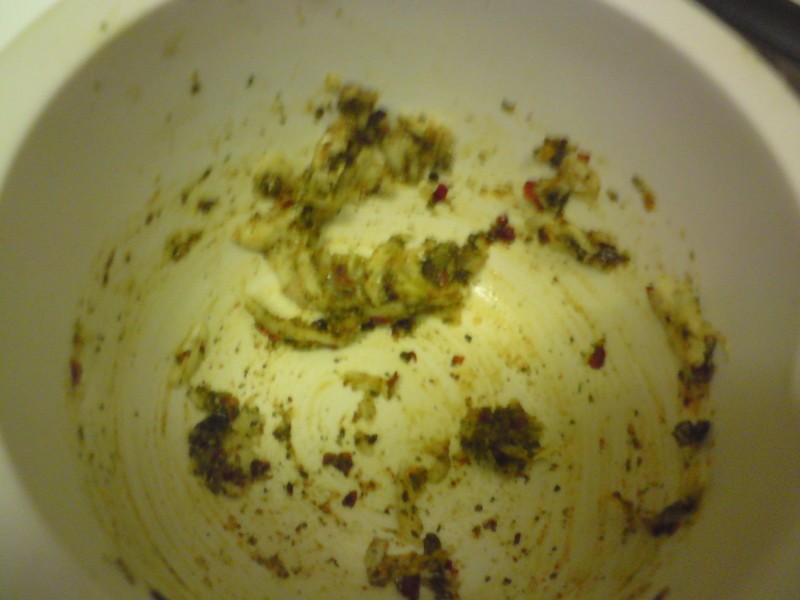
Locate an element on the screen. The width and height of the screenshot is (800, 600). lower left side of bowls rim is located at coordinates (9, 589).